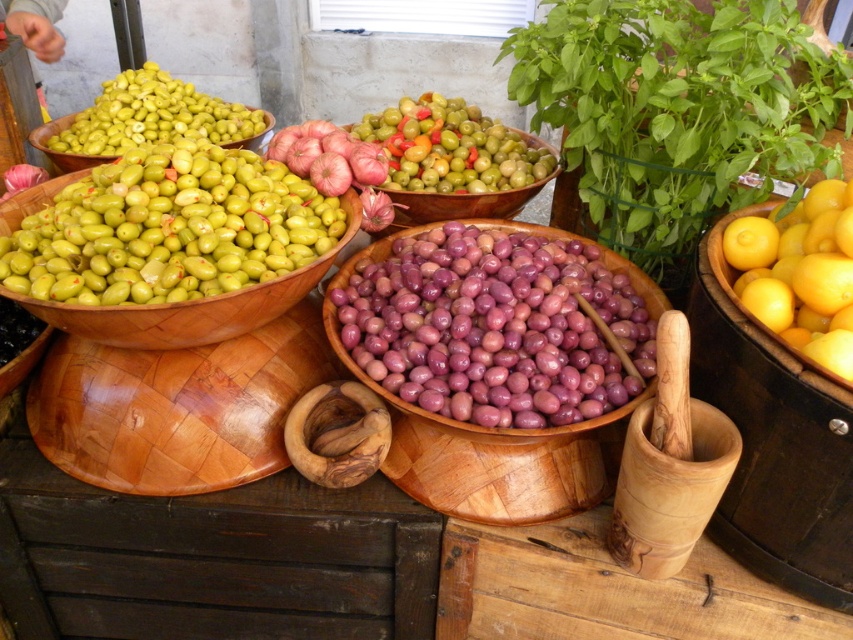
Question: Can you confirm if yellow smooth lemon at right is positioned above green olive wood bowl at upper left?

Choices:
 (A) no
 (B) yes

Answer: (A)

Question: Which object appears closest to the camera in this image?

Choices:
 (A) purple glossy olives at center
 (B) matte green olives at upper left
 (C) green matte olives at left
 (D) yellow smooth lemon at right

Answer: (D)

Question: In this image, where is green matte olives at center located relative to green olive wood bowl at upper left?

Choices:
 (A) left
 (B) right

Answer: (B)

Question: Is yellow smooth lemon at right below matte green olives at upper left?

Choices:
 (A) yes
 (B) no

Answer: (A)

Question: Considering the real-world distances, which object is farthest from the purple glossy olives at center?

Choices:
 (A) green matte olives at center
 (B) yellow smooth lemon at right
 (C) green matte olives at left

Answer: (A)

Question: Which object is positioned closest to the matte green olives at upper left?

Choices:
 (A) green olive wood bowl at upper left
 (B) green matte olives at center

Answer: (A)